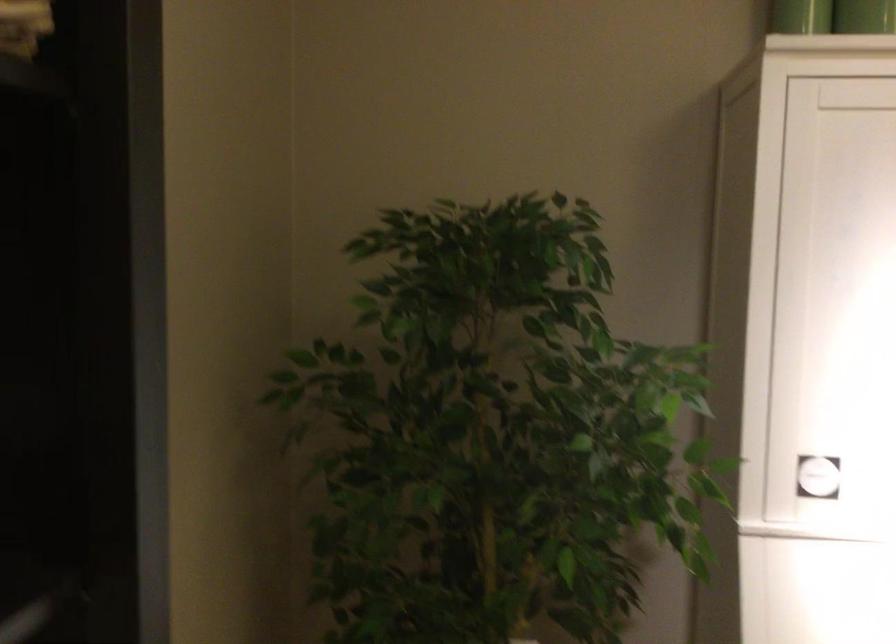
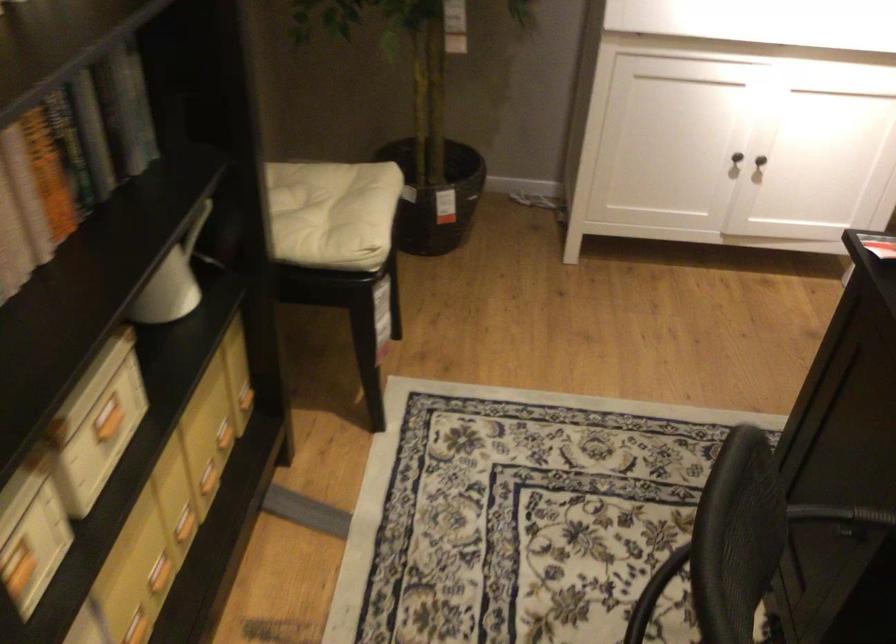
Question: The first image is from the beginning of the video and the second image is from the end. How did the camera likely rotate when shooting the video?

Choices:
 (A) Left
 (B) Right
 (C) Up
 (D) Down

Answer: (D)